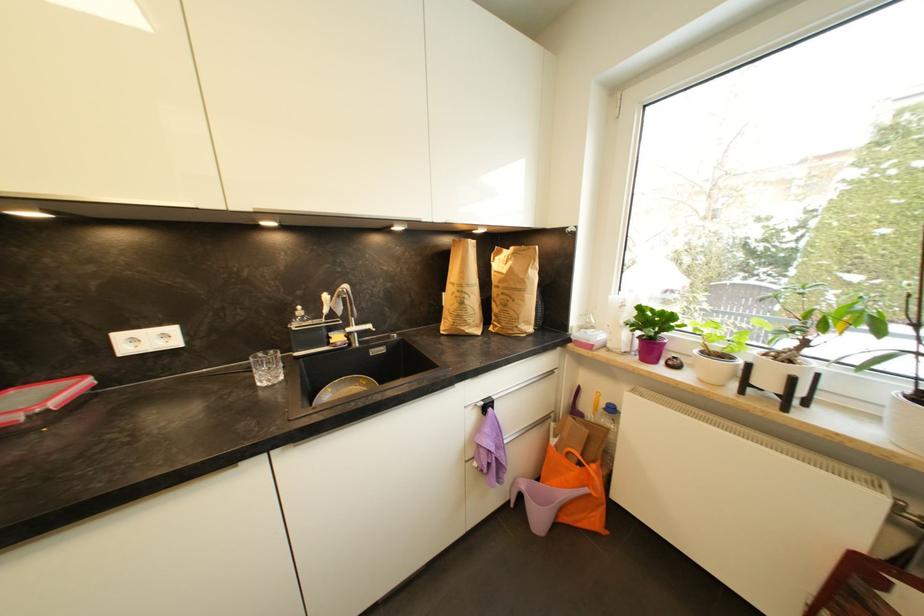
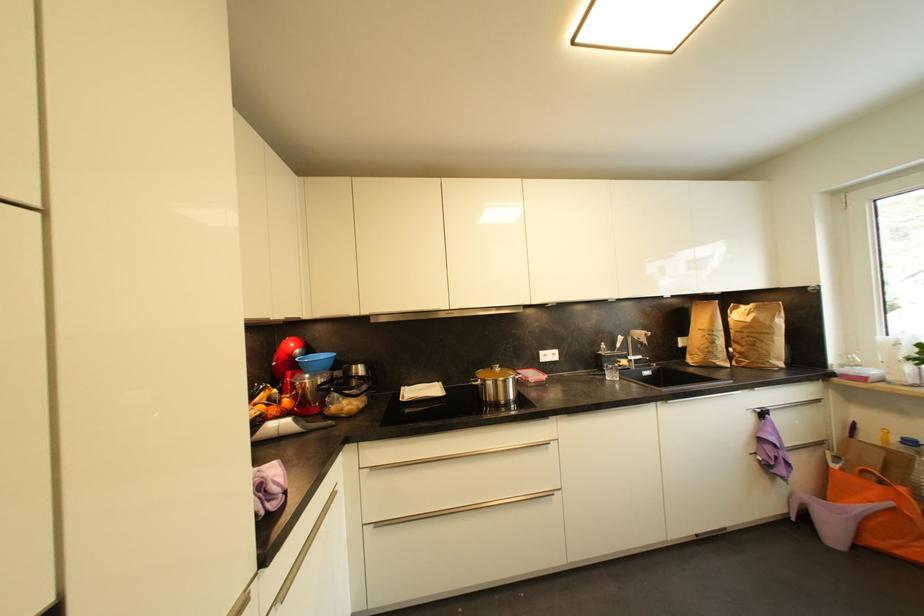
The point at (505, 284) is marked in the first image. Where is the corresponding point in the second image?

(748, 330)